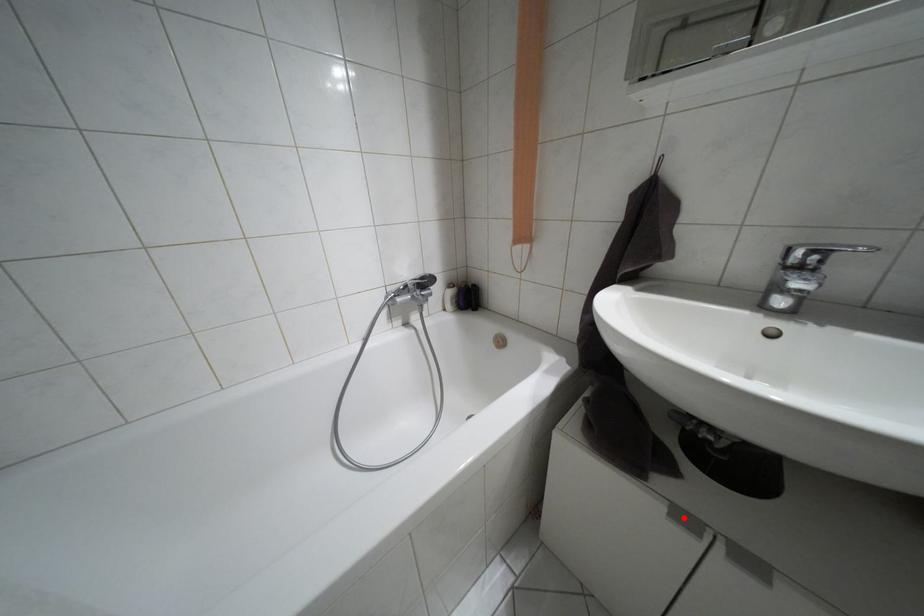
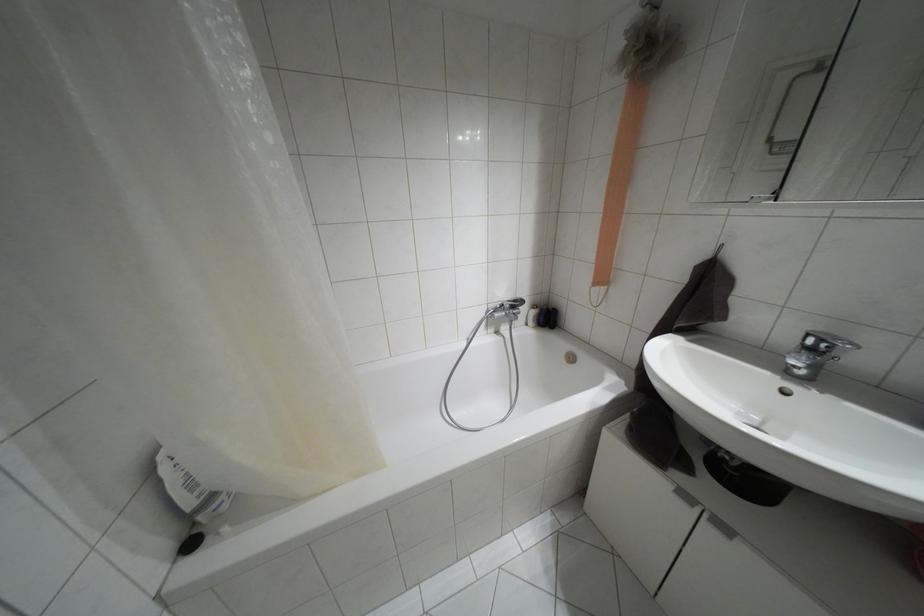
Find the pixel in the second image that matches the highlighted location in the first image.

(685, 496)